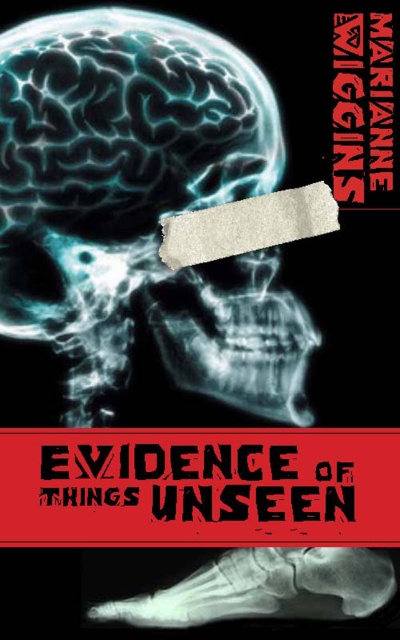
Question: Does x-ray skull at center come in front of x-ray bone at lower right?

Choices:
 (A) no
 (B) yes

Answer: (B)

Question: Which of the following is the closest to the observer?

Choices:
 (A) x-ray skull at center
 (B) x-ray bone at lower right

Answer: (A)

Question: Which object is farther from the camera taking this photo?

Choices:
 (A) x-ray skull at center
 (B) x-ray bone at lower right

Answer: (B)

Question: Can you confirm if x-ray skull at center is wider than x-ray bone at lower right?

Choices:
 (A) yes
 (B) no

Answer: (A)

Question: Is x-ray skull at center positioned at the back of x-ray bone at lower right?

Choices:
 (A) no
 (B) yes

Answer: (A)

Question: Among these objects, which one is farthest from the camera?

Choices:
 (A) x-ray skull at center
 (B) x-ray bone at lower right

Answer: (B)